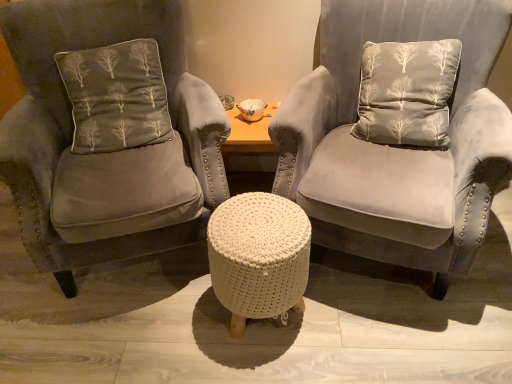
Question: From the image's perspective, does velvet gray chair at center, arranged as the first chair when viewed from the right, appear higher than white knitted pouf at center?

Choices:
 (A) no
 (B) yes

Answer: (B)

Question: Is velvet gray chair at center, arranged as the first chair when viewed from the right, not within white knitted pouf at center?

Choices:
 (A) yes
 (B) no

Answer: (A)

Question: Considering the relative sizes of velvet gray chair at center, arranged as the first chair when viewed from the right, and white knitted pouf at center in the image provided, is velvet gray chair at center, arranged as the first chair when viewed from the right, taller than white knitted pouf at center?

Choices:
 (A) yes
 (B) no

Answer: (A)

Question: Considering the relative sizes of velvet gray chair at center, placed as the 2th chair when sorted from left to right, and white knitted pouf at center in the image provided, is velvet gray chair at center, placed as the 2th chair when sorted from left to right, wider than white knitted pouf at center?

Choices:
 (A) no
 (B) yes

Answer: (B)

Question: From the image's perspective, is velvet gray chair at center, placed as the 2th chair when sorted from left to right, below white knitted pouf at center?

Choices:
 (A) no
 (B) yes

Answer: (A)

Question: Is dark gray velvet cushion at left wider or thinner than velvet gray chair at center, placed as the 2th chair when sorted from left to right?

Choices:
 (A) wide
 (B) thin

Answer: (B)

Question: Does point (90, 64) appear closer or farther from the camera than point (410, 233)?

Choices:
 (A) closer
 (B) farther

Answer: (B)

Question: From a real-world perspective, is dark gray velvet cushion at left positioned above or below velvet gray chair at center, placed as the 2th chair when sorted from left to right?

Choices:
 (A) below
 (B) above

Answer: (B)

Question: Is dark gray velvet cushion at left to the left or to the right of velvet gray chair at center, arranged as the first chair when viewed from the right, in the image?

Choices:
 (A) right
 (B) left

Answer: (B)

Question: From the image's perspective, relative to velvet gray armchair at center, the first chair from the left, is dark gray velvet cushion at left above or below?

Choices:
 (A) above
 (B) below

Answer: (A)

Question: Is point (100, 137) closer or farther from the camera than point (131, 125)?

Choices:
 (A) farther
 (B) closer

Answer: (B)

Question: Based on their sizes in the image, would you say dark gray velvet cushion at left is bigger or smaller than velvet gray armchair at center, which ranks as the 2th chair in right-to-left order?

Choices:
 (A) big
 (B) small

Answer: (B)

Question: Is dark gray velvet cushion at left inside the boundaries of velvet gray armchair at center, the first chair from the left, or outside?

Choices:
 (A) inside
 (B) outside

Answer: (A)

Question: In terms of size, does velvet gray armchair at center, which ranks as the 2th chair in right-to-left order, appear bigger or smaller than velvet gray chair at center, arranged as the first chair when viewed from the right?

Choices:
 (A) small
 (B) big

Answer: (B)

Question: Does point (179, 125) appear closer or farther from the camera than point (461, 271)?

Choices:
 (A) closer
 (B) farther

Answer: (B)